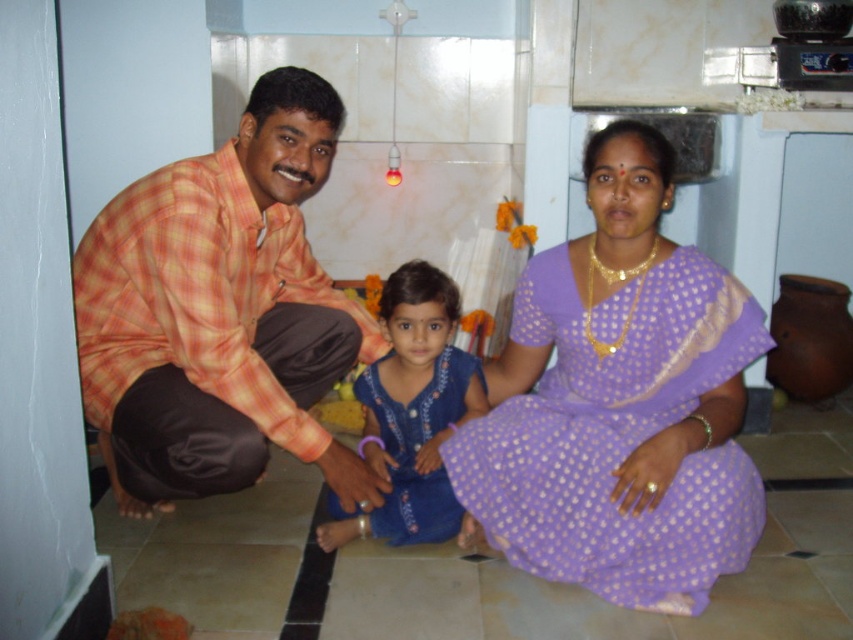
You are a fashion designer observing the purple silk saree at center and the orange plaid shirt at left in the image. Which of these two items has a smaller size?

The purple silk saree at center has a smaller size compared to the orange plaid shirt at left.

Looking at this image, you are a photographer setting up a shot in this kitchen scene. You want to ensure that the matte orange shirt at left and the purple silk saree at center are framed together. Given that the camera has a maximum focus range of 10 centimeters, will you be able to capture both subjects clearly in the same frame?

The distance between the matte orange shirt at left and the purple silk saree at center is 10.92 centimeters. Since the camera can only focus within 10 centimeters, the subjects are slightly out of the focus range. Adjust your position or use a different lens to ensure both are in focus.